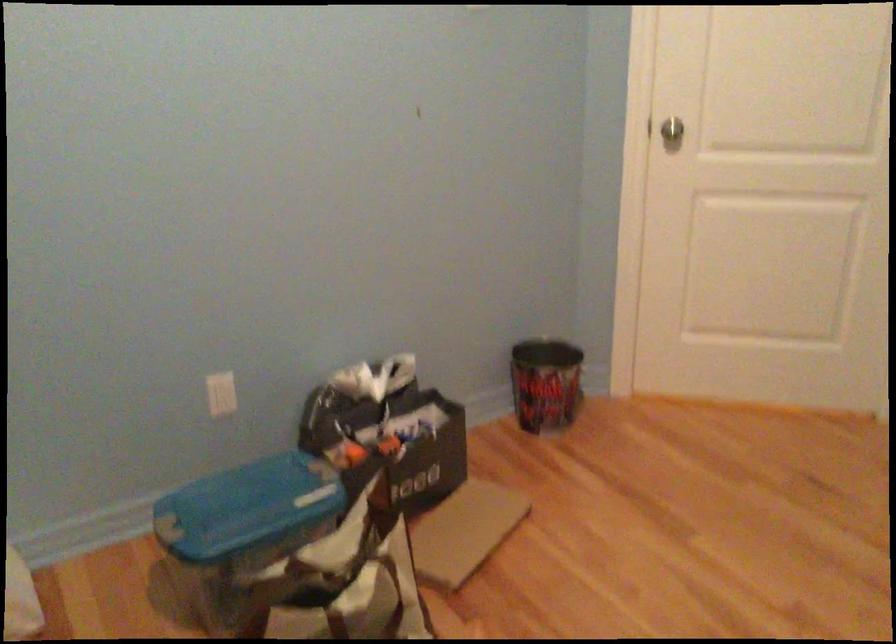
Find the location of `white light switch`. white light switch is located at coordinates (220, 393).